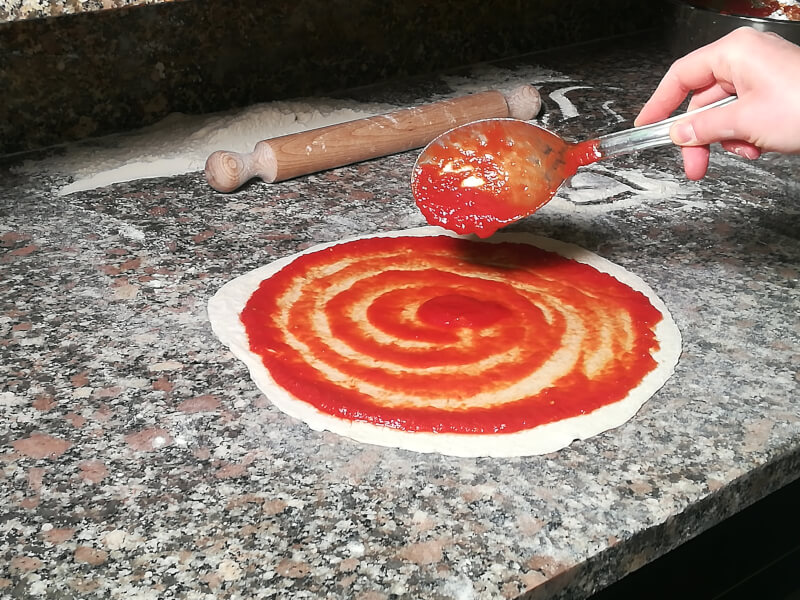
Find the location of a particular element. counter top is located at coordinates (368, 537).